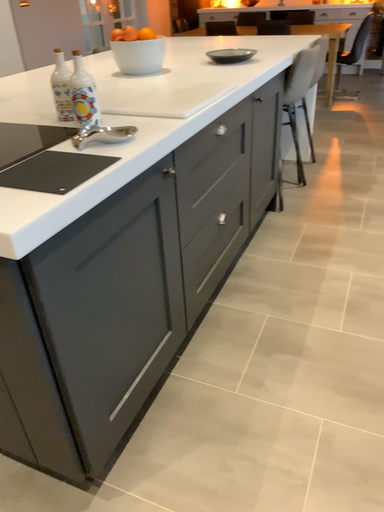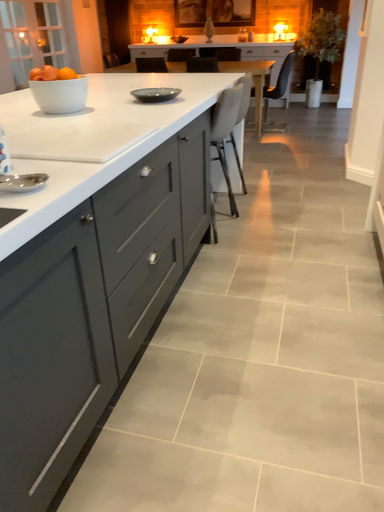
Question: How did the camera likely rotate when shooting the video?

Choices:
 (A) rotated left
 (B) rotated right

Answer: (B)